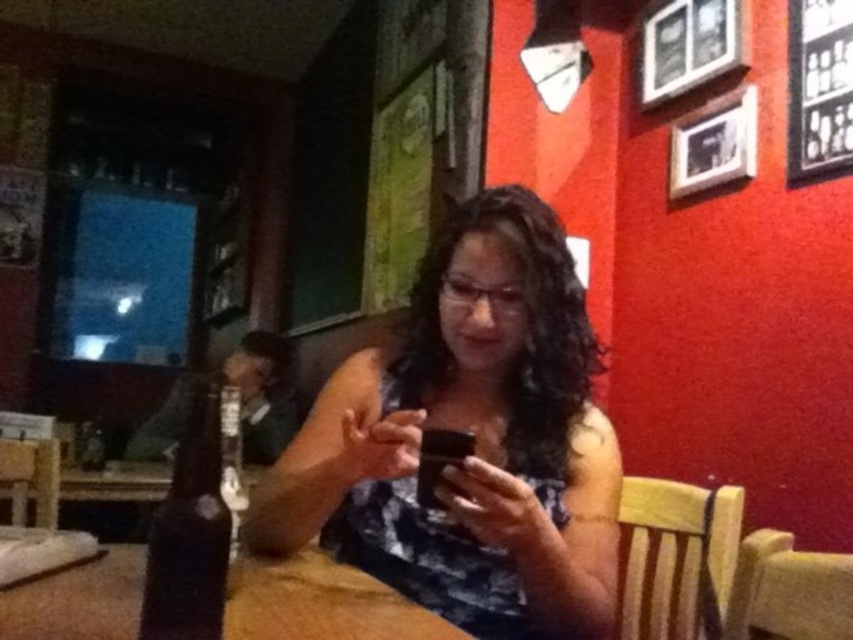
Does matte black phone at center appear over brown wood table at center?

Indeed, matte black phone at center is positioned over brown wood table at center.

Which is more to the right, matte black phone at center or brown wood table at center?

matte black phone at center is more to the right.

Is point (572, 470) positioned before point (271, 620)?

No, it is behind (271, 620).

You are a GUI agent. You are given a task and a screenshot of the screen. Output one action in this format:
    pyautogui.click(x=<x>, y=<y>)
    Task: Click on the matte black phone at center
    This screenshot has height=640, width=853.
    Given the screenshot: What is the action you would take?
    pyautogui.click(x=474, y=436)

Describe the element at coordinates (474, 436) in the screenshot. I see `matte black phone at center` at that location.

In the scene shown: Measure the distance between point [254,516] and camera.

The distance of point [254,516] from camera is 3.68 feet.

Does point (421, 548) come in front of point (231, 547)?

No, (421, 548) is further to viewer.

The height and width of the screenshot is (640, 853). What are the coordinates of `matte black phone at center` in the screenshot? It's located at (474, 436).

Is matte black phone at center positioned in front of dark brown glass bottle at lower left?

No, matte black phone at center is further to the viewer.

Can you confirm if matte black phone at center is bigger than dark brown glass bottle at lower left?

Correct, matte black phone at center is larger in size than dark brown glass bottle at lower left.

Describe the element at coordinates (474, 436) in the screenshot. The width and height of the screenshot is (853, 640). I see `matte black phone at center` at that location.

This screenshot has width=853, height=640. Identify the location of matte black phone at center. (474, 436).